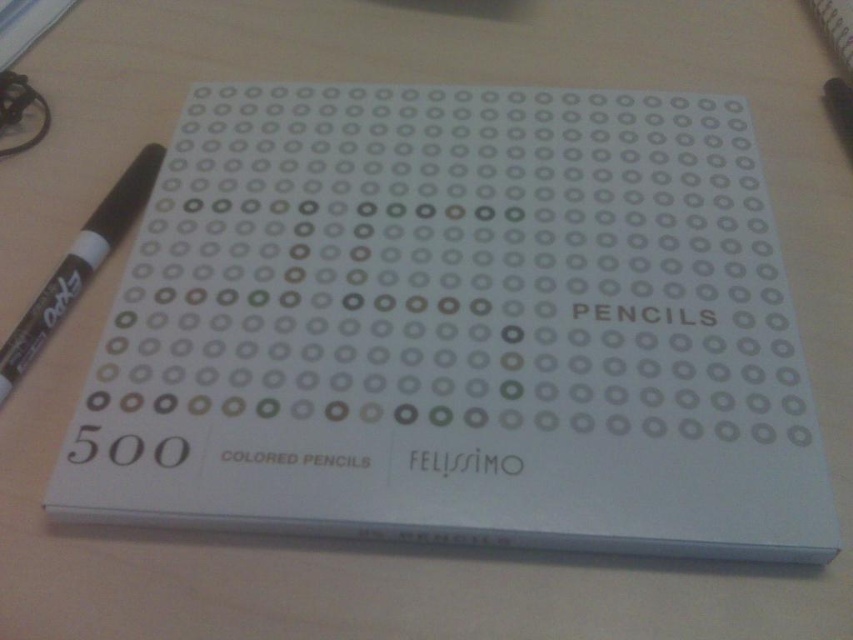
Between white matte box of colored pencils at center and black marker at left, which one is positioned higher?

black marker at left

Does white matte box of colored pencils at center have a smaller size compared to black marker at left?

No.

Find the location of a particular element. white matte box of colored pencils at center is located at coordinates (457, 326).

Locate an element on the screen. white matte box of colored pencils at center is located at coordinates (457, 326).